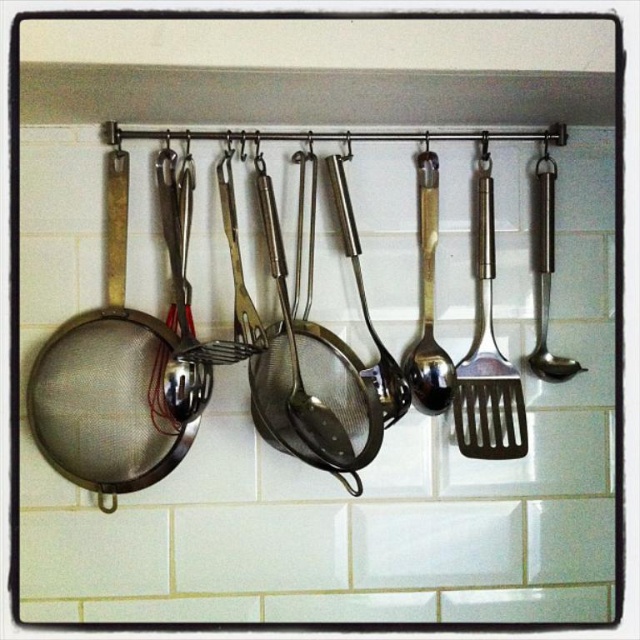
You are organizing the utensils in the kitchen rack. You have a satin gold spoon at center and a satin silver strainer at center. Which one can you place in a smaller designated space without bending?

The satin gold spoon at center has a smaller size compared to the satin silver strainer at center, so it can fit into the smaller designated space without bending.

You are organizing kitchen utensils and see the satin gold spoon at center and the satin silver spoon at center in the utensil rack. Which spoon is located lower in the rack?

The satin gold spoon at center is positioned under the satin silver spoon at center, so it is located lower in the rack.